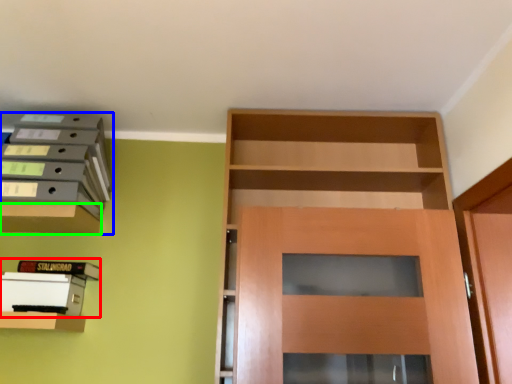
Question: Considering the real-world distances, which object is farthest from book (highlighted by a red box)? shelf (highlighted by a blue box) or cabinetry (highlighted by a green box)?

Choices:
 (A) shelf
 (B) cabinetry

Answer: (A)